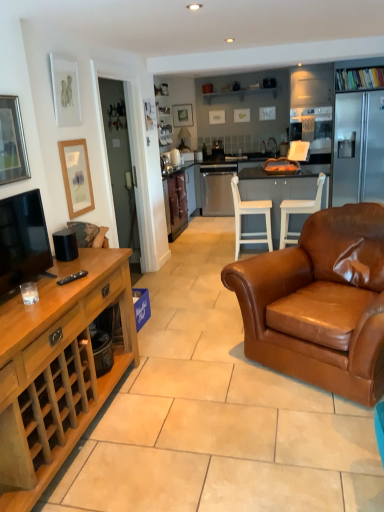
Question: Is the position of matte black picture frame at upper center, the 4th picture frame in the front-to-back sequence, more distant than that of wooden cabinet at left, placed as the first cabinetry when sorted from front to back?

Choices:
 (A) no
 (B) yes

Answer: (B)

Question: Is matte black picture frame at upper center, the 1th picture frame viewed from the back, next to wooden cabinet at left, placed as the first cabinetry when sorted from front to back, and touching it?

Choices:
 (A) no
 (B) yes

Answer: (A)

Question: Can you confirm if matte black picture frame at upper center, the 1th picture frame viewed from the back, is wider than wooden cabinet at left, arranged as the 1th cabinetry when ordered from the bottom?

Choices:
 (A) yes
 (B) no

Answer: (B)

Question: From a real-world perspective, is matte black picture frame at upper center, the 1th picture frame from the top, below wooden cabinet at left, arranged as the 1th cabinetry when ordered from the bottom?

Choices:
 (A) yes
 (B) no

Answer: (B)

Question: Does matte black picture frame at upper center, the 1th picture frame from the top, have a lesser height compared to wooden cabinet at left, placed as the first cabinetry when sorted from front to back?

Choices:
 (A) no
 (B) yes

Answer: (B)

Question: From the image's perspective, is brown leather cabinet at center, the 1th cabinetry from the back, above or below matte black picture frame at upper center, the 1th picture frame viewed from the back?

Choices:
 (A) below
 (B) above

Answer: (A)

Question: Looking at their shapes, would you say brown leather cabinet at center, the 2th cabinetry when ordered from front to back, is wider or thinner than matte black picture frame at upper center, which ranks as the fourth picture frame in left-to-right order?

Choices:
 (A) thin
 (B) wide

Answer: (B)

Question: In the image, is brown leather cabinet at center, which appears as the first cabinetry when viewed from the top, on the left side or the right side of matte black picture frame at upper center, the 1th picture frame viewed from the back?

Choices:
 (A) right
 (B) left

Answer: (B)

Question: Is brown leather cabinet at center, which appears as the first cabinetry when viewed from the top, taller or shorter than matte black picture frame at upper center, the 4th picture frame in the front-to-back sequence?

Choices:
 (A) short
 (B) tall

Answer: (B)

Question: Do you think matte wooden picture frame at left, the 3th picture frame positioned from the left, is within matte black tv at left, or outside of it?

Choices:
 (A) inside
 (B) outside

Answer: (B)

Question: Relative to matte black tv at left, is matte wooden picture frame at left, the first picture frame positioned from the bottom, in front or behind?

Choices:
 (A) front
 (B) behind

Answer: (B)

Question: In the image, is matte wooden picture frame at left, acting as the 3th picture frame starting from the front, on the left side or the right side of matte black tv at left?

Choices:
 (A) right
 (B) left

Answer: (A)

Question: Is matte wooden picture frame at left, acting as the 3th picture frame starting from the front, wider or thinner than matte black tv at left?

Choices:
 (A) thin
 (B) wide

Answer: (A)

Question: Considering the positions of matte wooden picture frame at left, positioned as the fourth picture frame in top-to-bottom order, and white glossy kettle at center in the image, is matte wooden picture frame at left, positioned as the fourth picture frame in top-to-bottom order, taller or shorter than white glossy kettle at center?

Choices:
 (A) tall
 (B) short

Answer: (A)

Question: From a real-world perspective, is matte wooden picture frame at left, which is the second picture frame in right-to-left order, positioned above or below white glossy kettle at center?

Choices:
 (A) above
 (B) below

Answer: (A)